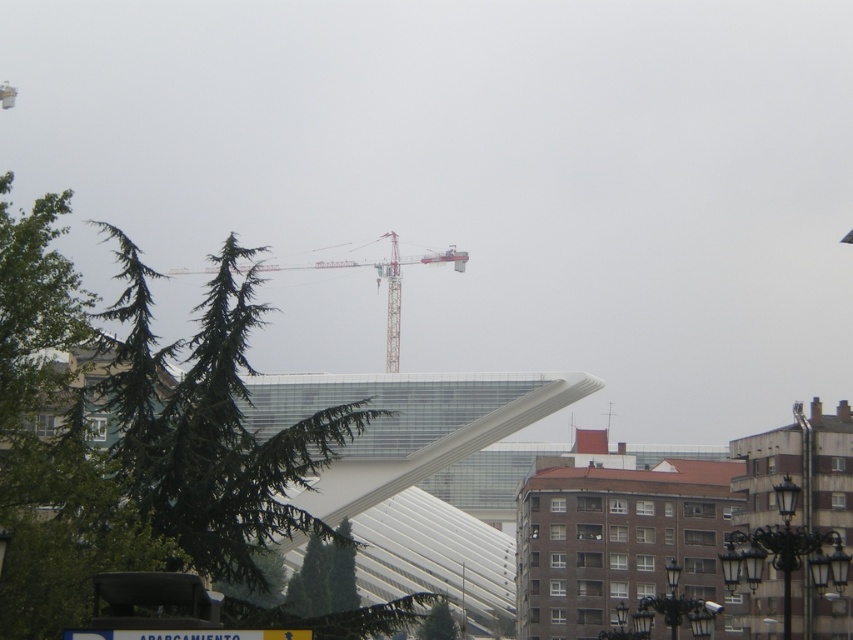
You are a city planner reviewing this urban scene. You need to assess the placement of the metallic gray crane at center and the green matte tree at lower center. Based on their positions, which object is closer to the left side of the image?

The metallic gray crane at center is to the left of the green matte tree at lower center, so the metallic gray crane at center is closer to the left side of the image.